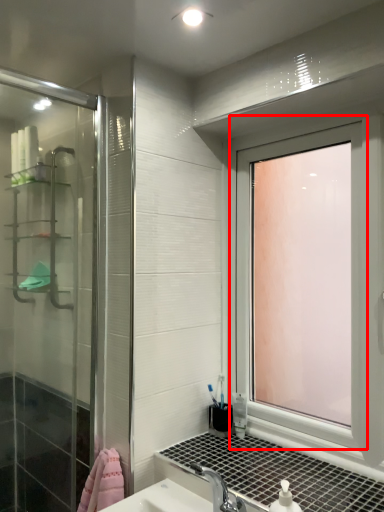
Question: From the image's perspective, considering the relative positions of window (annotated by the red box) and shelf in the image provided, where is window (annotated by the red box) located with respect to the staircase?

Choices:
 (A) below
 (B) above

Answer: (A)